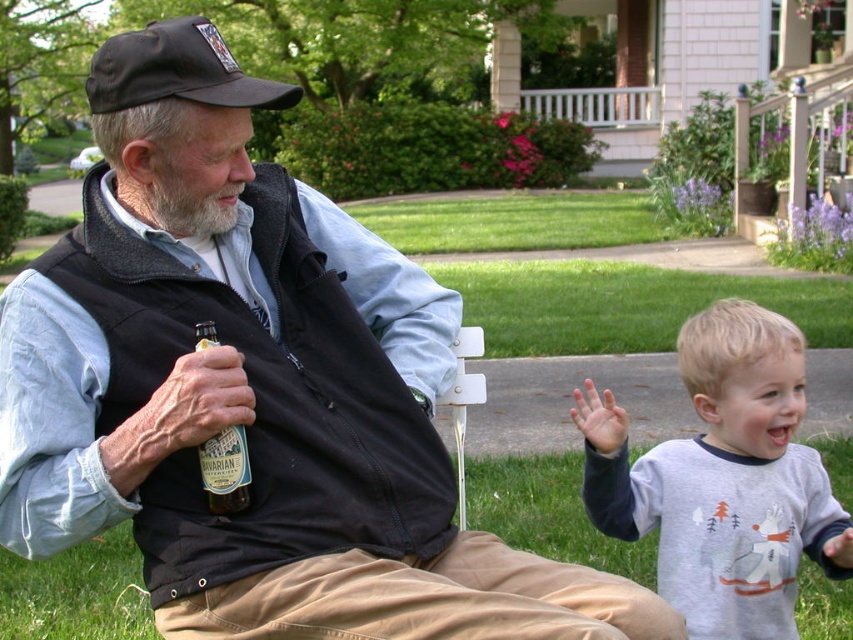
Is black fabric baseball cap at upper left wider than graywoollybeard at left?

Yes, black fabric baseball cap at upper left is wider than graywoollybeard at left.

Between point (222, 90) and point (216, 176), which one is positioned in front?

Point (222, 90) is more forward.

Locate an element on the screen. black fabric baseball cap at upper left is located at coordinates (177, 70).

Which is behind, point (692, 544) or point (161, 93)?

Point (692, 544)

Does gray cotton shirt at lower right have a lesser width compared to black fabric baseball cap at upper left?

No, gray cotton shirt at lower right is not thinner than black fabric baseball cap at upper left.

This screenshot has height=640, width=853. Find the location of `gray cotton shirt at lower right`. gray cotton shirt at lower right is located at coordinates 723,477.

Is graywoollybeard at left to the left of green glass bottle at center from the viewer's perspective?

Indeed, graywoollybeard at left is positioned on the left side of green glass bottle at center.

Find the location of `graywoollybeard at left`. graywoollybeard at left is located at coordinates (190, 193).

Does point (209, 224) lie in front of point (200, 326)?

No, (209, 224) is further to viewer.

The height and width of the screenshot is (640, 853). In order to click on graywoollybeard at left in this screenshot , I will do `click(190, 193)`.